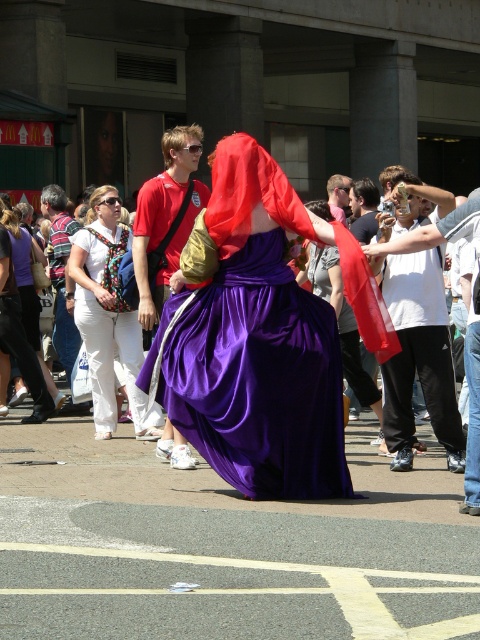
Who is taller, satin purple dress at center or matte white pants at lower left?

satin purple dress at center is taller.

Is satin purple dress at center further to camera compared to matte white pants at lower left?

No, satin purple dress at center is in front of matte white pants at lower left.

Who is more distant from viewer, [248,484] or [12,305]?

The point [12,305] is more distant.

In order to click on satin purple dress at center in this screenshot , I will do `click(261, 337)`.

Does matte white pants at center lie behind matte white pants at lower left?

That is False.

The height and width of the screenshot is (640, 480). Find the location of `matte white pants at center`. matte white pants at center is located at coordinates pos(108,321).

Which is in front, point (97, 310) or point (35, 394)?

Point (97, 310)

The width and height of the screenshot is (480, 640). I want to click on matte white pants at center, so click(108, 321).

Between purple satin dress at center and matte white pants at lower left, which one is positioned higher?

matte white pants at lower left is above.

Is purple satin dress at center further to the viewer compared to matte white pants at lower left?

No.

Locate an element on the screen. purple satin dress at center is located at coordinates (419, 349).

Where is `purple satin dress at center`? This screenshot has width=480, height=640. purple satin dress at center is located at coordinates (419, 349).